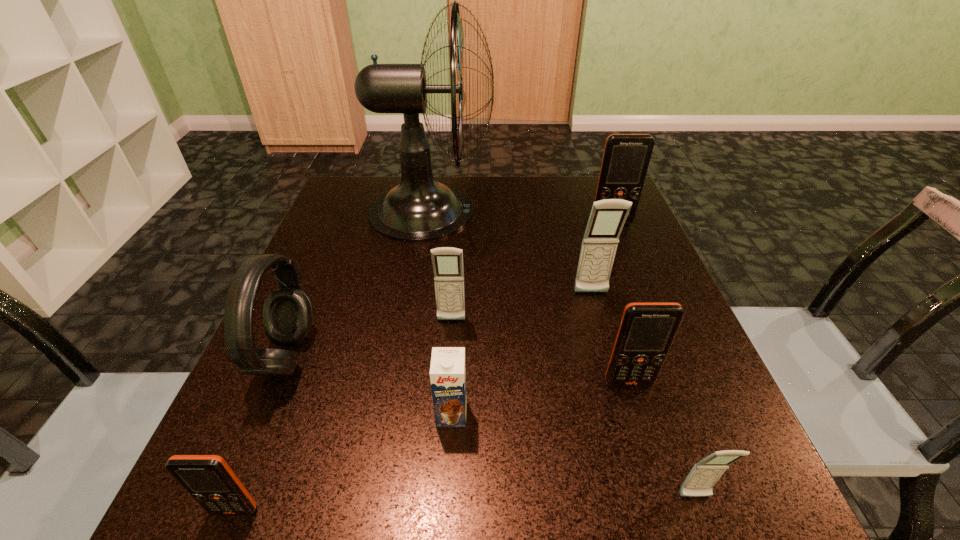
The height and width of the screenshot is (540, 960). I want to click on fan, so click(419, 209).

You are a GUI agent. You are given a task and a screenshot of the screen. Output one action in this format:
    pyautogui.click(x=<x>, y=<y>)
    Task: Click on the seventh nearest object
    The image size is (960, 540).
    Given the screenshot: What is the action you would take?
    pyautogui.click(x=607, y=217)

Locate an element on the screen. This screenshot has width=960, height=540. the second gray cellular telephone from right to left is located at coordinates point(607,217).

The width and height of the screenshot is (960, 540). I want to click on the farthest orange cellular telephone, so click(x=626, y=157).

Where is `the farthest cellular telephone`? This screenshot has width=960, height=540. the farthest cellular telephone is located at coordinates (626, 157).

Image resolution: width=960 pixels, height=540 pixels. I want to click on gray headset, so click(288, 311).

At what (x,y) coordinates should I click in order to perform the action: click on the third farthest cellular telephone. Please return your answer as a coordinate pair (x, y). This screenshot has width=960, height=540. Looking at the image, I should click on (447, 262).

Where is `the second smallest gray cellular telephone`? the second smallest gray cellular telephone is located at coordinates (x=447, y=262).

Locate an element on the screen. The height and width of the screenshot is (540, 960). the second nearest orange cellular telephone is located at coordinates (647, 330).

Locate an element on the screen. The image size is (960, 540). the second smallest orange cellular telephone is located at coordinates (647, 330).